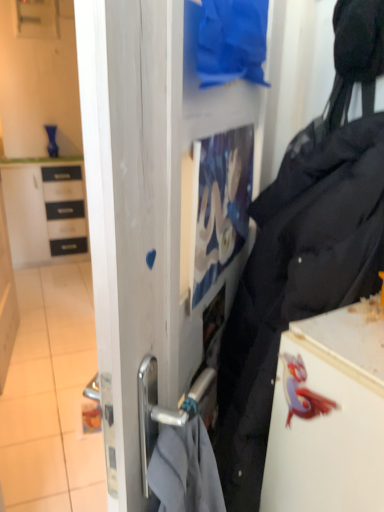
Question: Is white glossy cabinet at left facing away from white glossy fridge at lower right?

Choices:
 (A) yes
 (B) no

Answer: (B)

Question: Is the depth of white glossy cabinet at left greater than that of white glossy fridge at lower right?

Choices:
 (A) yes
 (B) no

Answer: (A)

Question: Is white glossy cabinet at left not within white glossy fridge at lower right?

Choices:
 (A) yes
 (B) no

Answer: (A)

Question: Can you confirm if white glossy cabinet at left is smaller than white glossy fridge at lower right?

Choices:
 (A) yes
 (B) no

Answer: (B)

Question: From a real-world perspective, is white glossy cabinet at left located higher than white glossy fridge at lower right?

Choices:
 (A) yes
 (B) no

Answer: (B)

Question: Does white glossy cabinet at left appear on the left side of white glossy fridge at lower right?

Choices:
 (A) no
 (B) yes

Answer: (B)

Question: Does blue fabric at upper center appear on the right side of white glossy fridge at lower right?

Choices:
 (A) yes
 (B) no

Answer: (B)

Question: Is blue fabric at upper center aimed at white glossy fridge at lower right?

Choices:
 (A) no
 (B) yes

Answer: (A)

Question: Does blue fabric at upper center have a lesser width compared to white glossy fridge at lower right?

Choices:
 (A) no
 (B) yes

Answer: (B)

Question: From the image's perspective, is blue fabric at upper center located beneath white glossy fridge at lower right?

Choices:
 (A) yes
 (B) no

Answer: (B)

Question: Are blue fabric at upper center and white glossy fridge at lower right located far from each other?

Choices:
 (A) no
 (B) yes

Answer: (A)

Question: Is blue fabric at upper center touching white glossy fridge at lower right?

Choices:
 (A) yes
 (B) no

Answer: (B)

Question: Considering the relative sizes of white glossy tile at lower left and white glossy fridge at lower right in the image provided, is white glossy tile at lower left taller than white glossy fridge at lower right?

Choices:
 (A) yes
 (B) no

Answer: (B)